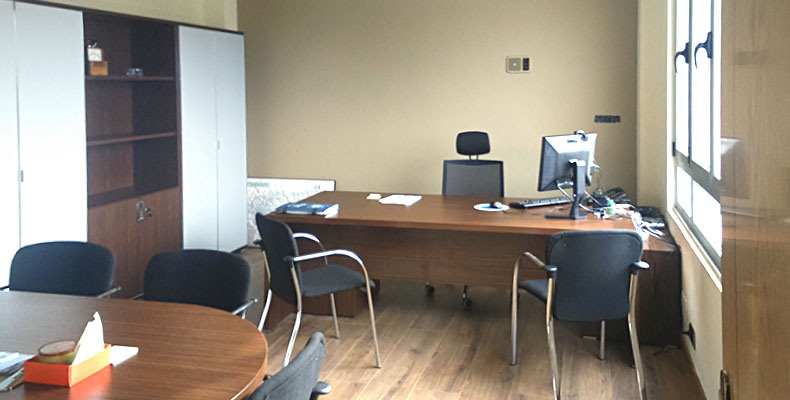
Find the location of a particular element. monitor is located at coordinates (558, 150).